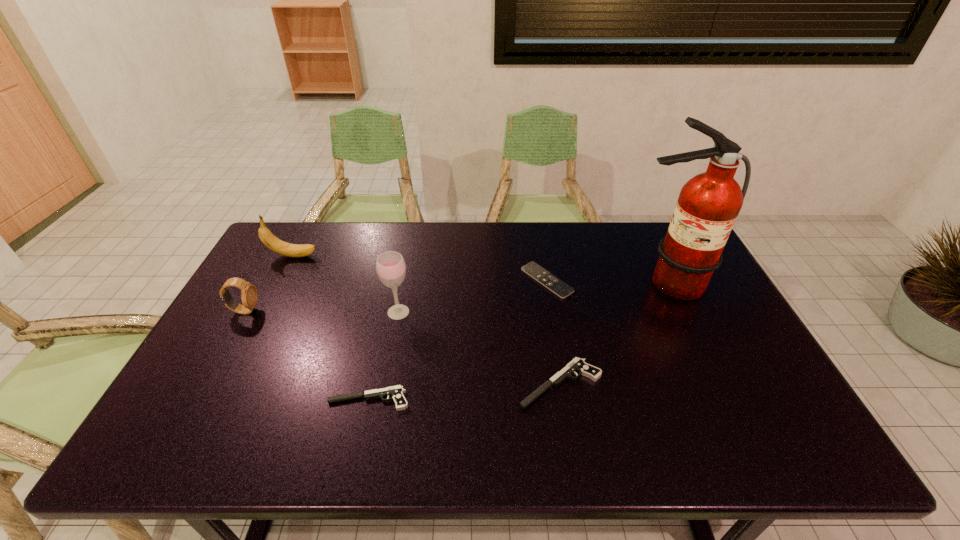
The image size is (960, 540). What are the coordinates of `free space located on the front of the remote control` in the screenshot? It's located at (556, 334).

At what (x,y) coordinates should I click in order to perform the action: click on free space located 0.160m on the nozzle and handle of the rightmost object. Please return your answer as a coordinate pair (x, y). Image resolution: width=960 pixels, height=540 pixels. Looking at the image, I should click on point(696,344).

The image size is (960, 540). I want to click on object present at the far edge, so click(272, 242).

This screenshot has width=960, height=540. Identify the location of banana situated at the left edge. tap(272, 242).

Identify the location of watch at the left edge. (249, 297).

Find the location of a particular element. The height and width of the screenshot is (540, 960). object at the right edge is located at coordinates (708, 205).

The width and height of the screenshot is (960, 540). What are the coordinates of `object at the far left corner` in the screenshot? It's located at (272, 242).

Find the location of a particular element. vacant space at the far edge of the desktop is located at coordinates (518, 251).

What are the coordinates of `vacant space at the near edge of the desktop` in the screenshot? It's located at (466, 391).

In the image, there is a desktop. Identify the location of vacant space at the left edge. This screenshot has height=540, width=960. tap(290, 265).